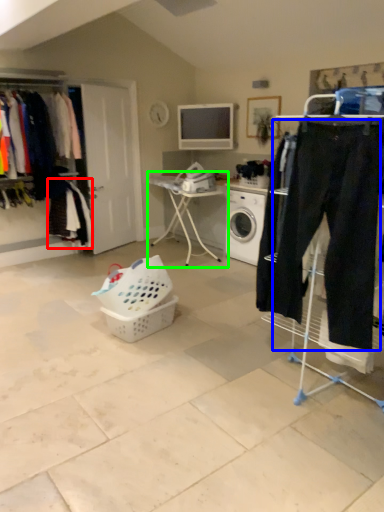
Question: Estimate the real-world distances between objects in this image. Which object is farther from clothing (highlighted by a red box), sweat pant (highlighted by a blue box) or table (highlighted by a green box)?

Choices:
 (A) sweat pant
 (B) table

Answer: (A)